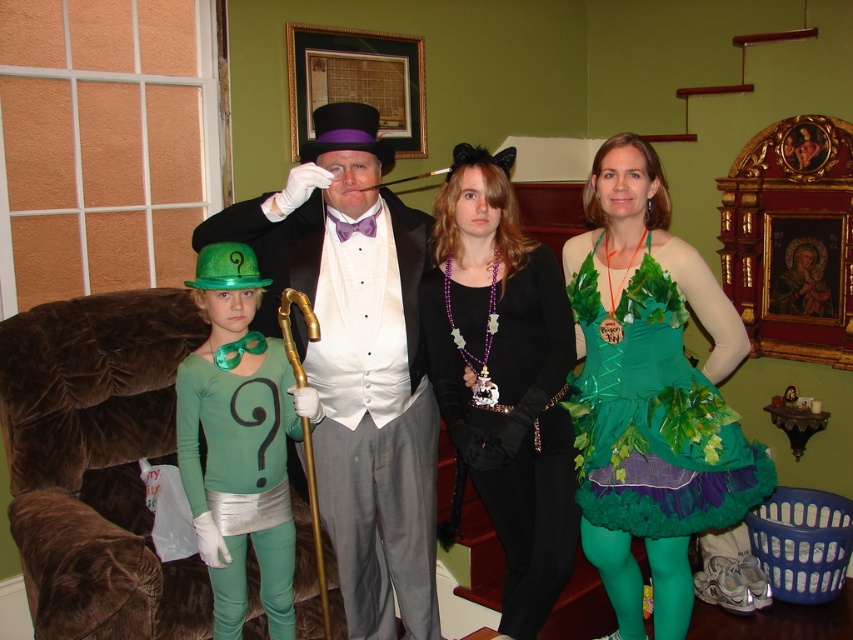
Does green fabric dress at center have a greater width compared to green matte tights at left?

Indeed, green fabric dress at center has a greater width compared to green matte tights at left.

Who is positioned more to the right, green fabric dress at center or green matte tights at left?

green fabric dress at center is more to the right.

This screenshot has width=853, height=640. Identify the location of green fabric dress at center. (650, 392).

Locate an element on the screen. The image size is (853, 640). green fabric dress at center is located at coordinates (650, 392).

What do you see at coordinates (357, 358) in the screenshot? I see `shiny black suit at center` at bounding box center [357, 358].

Between point (393, 580) and point (625, 584), which one is positioned in front?

Point (393, 580)

Find the location of a particular element. shiny black suit at center is located at coordinates click(357, 358).

In order to click on shiny black suit at center in this screenshot , I will do (x=357, y=358).

Does shiny black suit at center appear on the right side of green matte tights at left?

Correct, you'll find shiny black suit at center to the right of green matte tights at left.

Between shiny black suit at center and green matte tights at left, which one is positioned higher?

shiny black suit at center is above.

The width and height of the screenshot is (853, 640). What do you see at coordinates (357, 358) in the screenshot? I see `shiny black suit at center` at bounding box center [357, 358].

This screenshot has height=640, width=853. Find the location of `shiny black suit at center`. shiny black suit at center is located at coordinates (357, 358).